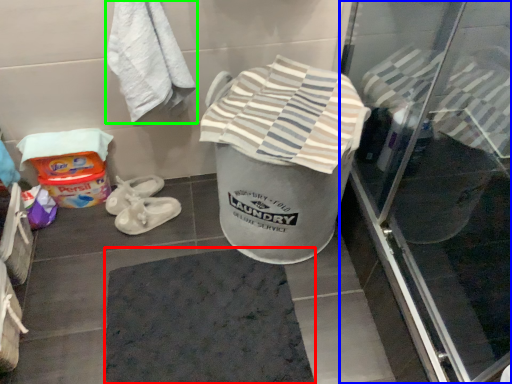
Question: Considering the real-world distances, which object is farthest from bath mat (highlighted by a red box)? screen door (highlighted by a blue box) or towel (highlighted by a green box)?

Choices:
 (A) screen door
 (B) towel

Answer: (B)